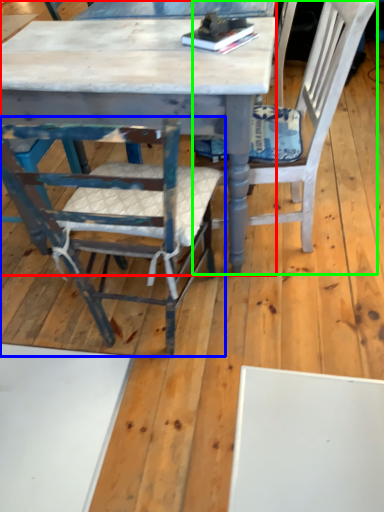
Question: Based on their relative distances, which object is nearer to table (highlighted by a red box)? Choose from chair (highlighted by a blue box) and chair (highlighted by a green box).

Choices:
 (A) chair
 (B) chair

Answer: (A)